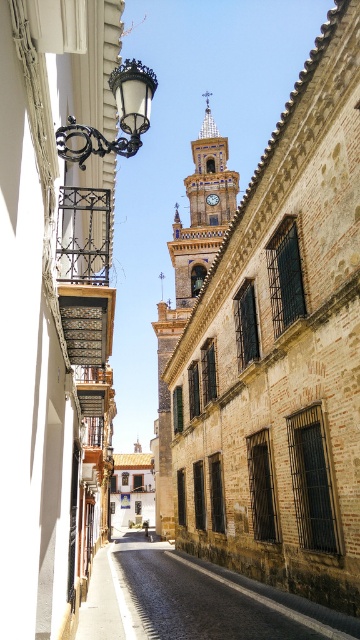
You are a GUI agent. You are given a task and a screenshot of the screen. Output one action in this format:
    pyautogui.click(x=<x>, y=<y>)
    Task: Click on the golden brick church at center
    
    Given the screenshot: What is the action you would take?
    pyautogui.click(x=272, y=342)

Describe the element at coordinates (272, 342) in the screenshot. I see `golden brick church at center` at that location.

Where is `golden brick church at center`? The image size is (360, 640). golden brick church at center is located at coordinates (272, 342).

Does golden brick church at center appear over cobblestone street at center?

Yes, golden brick church at center is above cobblestone street at center.

Who is positioned more to the left, golden brick church at center or cobblestone street at center?

Positioned to the left is cobblestone street at center.

Does point (303, 401) come behind point (191, 577)?

No, it is not.

Find the location of `golden brick church at center`. golden brick church at center is located at coordinates (272, 342).

Can you confirm if cobblestone street at center is positioned to the right of golden stone clock tower at center?

Incorrect, cobblestone street at center is not on the right side of golden stone clock tower at center.

Which is below, cobblestone street at center or golden stone clock tower at center?

cobblestone street at center is below.

Which is in front, point (106, 609) or point (204, 129)?

Point (106, 609)

Locate an element on the screen. The image size is (360, 640). cobblestone street at center is located at coordinates (191, 600).